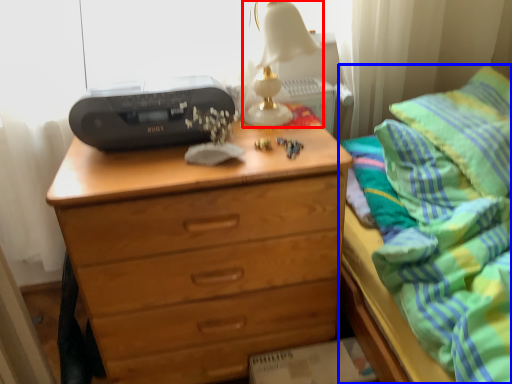
Question: Which object appears closest to the camera in this image, table lamp (highlighted by a red box) or bed (highlighted by a blue box)?

Choices:
 (A) table lamp
 (B) bed

Answer: (B)